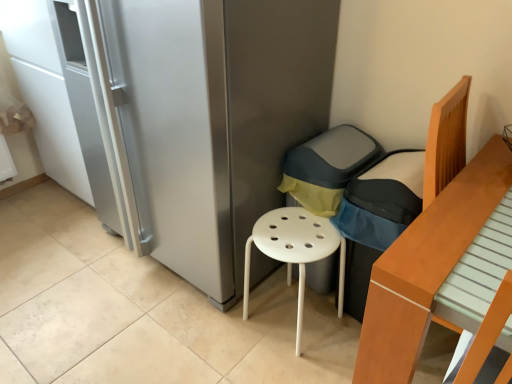
Question: Would you consider dark gray fabric armchair at center to be distant from light brown wooden bed at right?

Choices:
 (A) no
 (B) yes

Answer: (A)

Question: From the image's perspective, is dark gray fabric armchair at center on light brown wooden bed at right?

Choices:
 (A) no
 (B) yes

Answer: (B)

Question: Is the position of dark gray fabric armchair at center more distant than that of light brown wooden bed at right?

Choices:
 (A) yes
 (B) no

Answer: (A)

Question: Considering the relative positions of dark gray fabric armchair at center and light brown wooden bed at right in the image provided, is dark gray fabric armchair at center to the right of light brown wooden bed at right from the viewer's perspective?

Choices:
 (A) no
 (B) yes

Answer: (A)

Question: Considering the relative positions of dark gray fabric armchair at center and light brown wooden bed at right in the image provided, is dark gray fabric armchair at center in front of light brown wooden bed at right?

Choices:
 (A) no
 (B) yes

Answer: (A)

Question: Based on their positions, is satin silver fridge at center located to the left or right of light brown wooden bed at right?

Choices:
 (A) right
 (B) left

Answer: (B)

Question: From their relative heights in the image, would you say satin silver fridge at center is taller or shorter than light brown wooden bed at right?

Choices:
 (A) tall
 (B) short

Answer: (A)

Question: Based on their sizes in the image, would you say satin silver fridge at center is bigger or smaller than light brown wooden bed at right?

Choices:
 (A) small
 (B) big

Answer: (B)

Question: In terms of width, does satin silver fridge at center look wider or thinner when compared to light brown wooden bed at right?

Choices:
 (A) wide
 (B) thin

Answer: (A)

Question: In the image, is white plastic stool at center positioned in front of or behind satin silver fridge at center?

Choices:
 (A) front
 (B) behind

Answer: (B)

Question: In terms of size, does white plastic stool at center appear bigger or smaller than satin silver fridge at center?

Choices:
 (A) big
 (B) small

Answer: (B)

Question: From their relative heights in the image, would you say white plastic stool at center is taller or shorter than satin silver fridge at center?

Choices:
 (A) short
 (B) tall

Answer: (A)

Question: Do you think white plastic stool at center is within satin silver fridge at center, or outside of it?

Choices:
 (A) outside
 (B) inside

Answer: (A)

Question: From a real-world perspective, relative to satin silver fridge at center, is dark gray fabric armchair at center vertically above or below?

Choices:
 (A) below
 (B) above

Answer: (A)

Question: Does point (449, 173) appear closer or farther from the camera than point (248, 167)?

Choices:
 (A) farther
 (B) closer

Answer: (B)